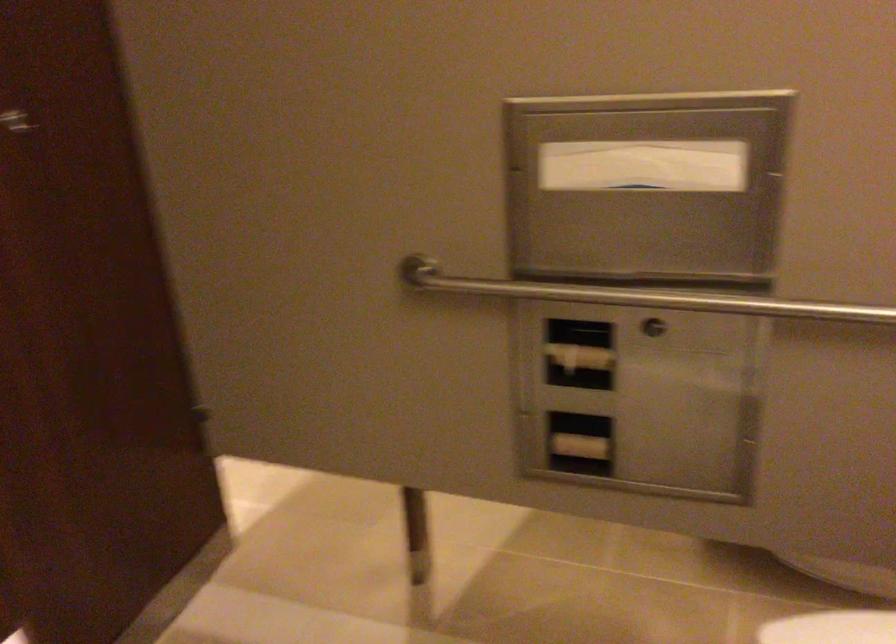
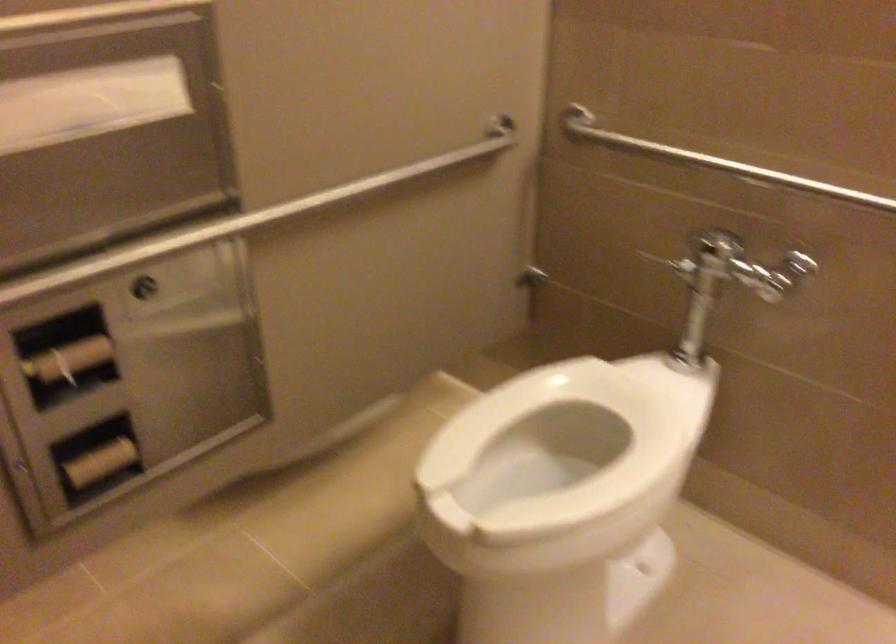
Locate, in the second image, the point that corresponds to the point at 572,355 in the first image.

(69, 359)